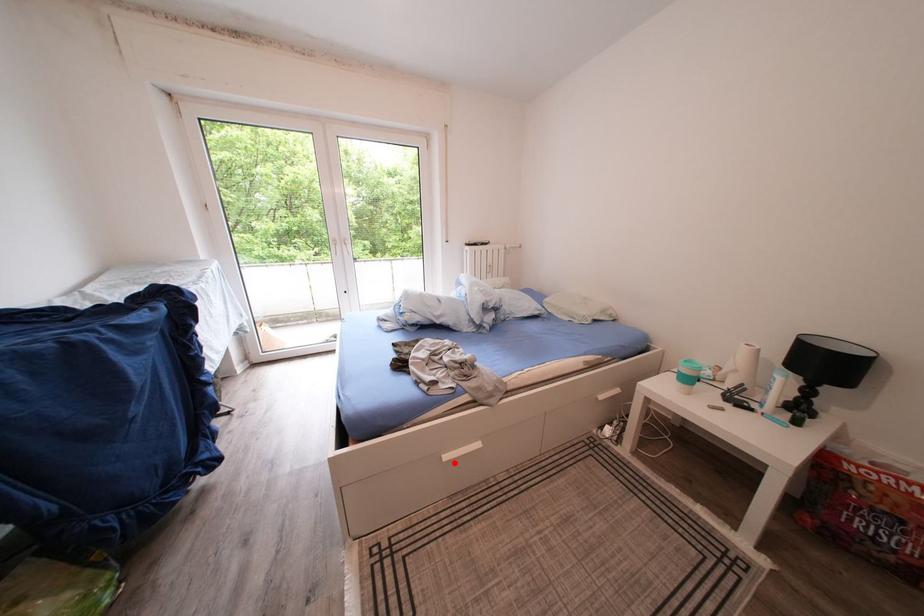
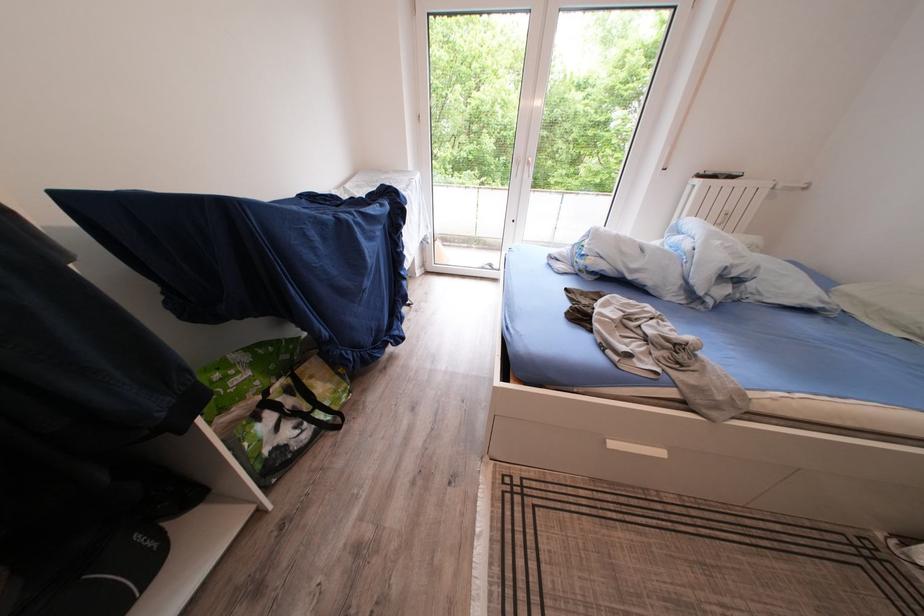
Where in the second image is the point corresponding to the highlighted location from the first image?

(621, 450)